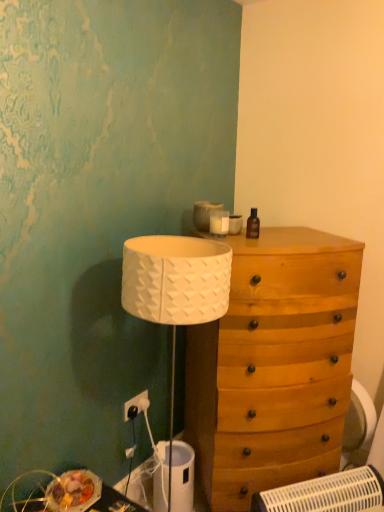
Question: Is wooden drawer at center inside or outside of brown glass bottle at upper right?

Choices:
 (A) inside
 (B) outside

Answer: (B)

Question: Is wooden drawer at center bigger or smaller than brown glass bottle at upper right?

Choices:
 (A) big
 (B) small

Answer: (A)

Question: Estimate the real-world distances between objects in this image. Which object is farther from the white plastic swivel chair at lower right?

Choices:
 (A) wooden chest of drawers at right
 (B) wooden drawer at center
 (C) brown glass bottle at upper right
 (D) white plastic electric outlet at lower left

Answer: (C)

Question: Which is farther from the white plastic swivel chair at lower right?

Choices:
 (A) wooden chest of drawers at right
 (B) white plastic electric outlet at lower left
 (C) brown glass bottle at upper right
 (D) wooden drawer at center

Answer: (C)